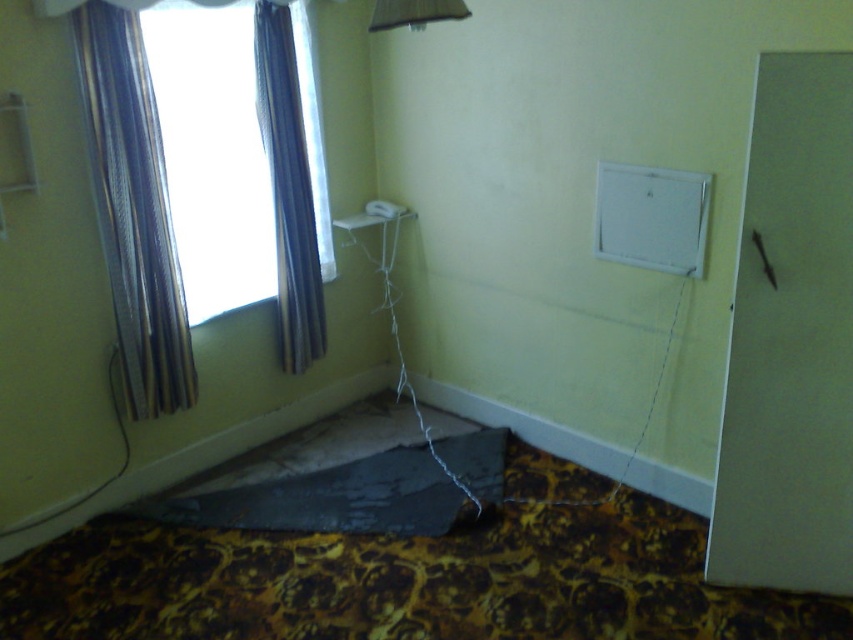
Which is in front, point (198, 288) or point (254, 36)?

Point (254, 36) is in front.

This screenshot has width=853, height=640. I want to click on transparent glass window at upper left, so click(x=212, y=154).

Which is behind, point (219, 312) or point (302, 252)?

The point (302, 252) is more distant.

Where is `transparent glass window at upper left`? This screenshot has width=853, height=640. transparent glass window at upper left is located at coordinates (212, 154).

Does transparent glass window at upper left appear over metallic fabric curtain at left?

Indeed, transparent glass window at upper left is positioned over metallic fabric curtain at left.

Who is positioned more to the left, transparent glass window at upper left or metallic fabric curtain at left?

Positioned to the left is metallic fabric curtain at left.

Is point (167, 97) behind point (122, 224)?

Yes.

You are a GUI agent. You are given a task and a screenshot of the screen. Output one action in this format:
    pyautogui.click(x=<x>, y=<y>)
    Task: Click on the transparent glass window at upper left
    This screenshot has width=853, height=640.
    Given the screenshot: What is the action you would take?
    pyautogui.click(x=212, y=154)

Can you confirm if metallic fabric curtain at left is bigger than satin fabric curtain at upper left?

Yes.

What do you see at coordinates (134, 211) in the screenshot?
I see `metallic fabric curtain at left` at bounding box center [134, 211].

Is point (108, 186) positioned behind point (305, 202)?

No, it is in front of (305, 202).

Find the location of `metallic fabric curtain at left`. metallic fabric curtain at left is located at coordinates (134, 211).